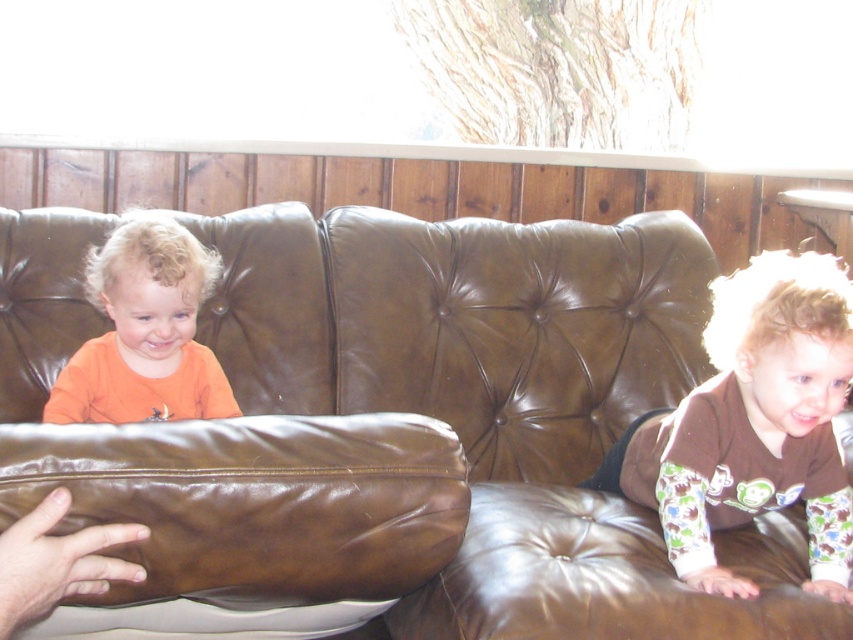
Question: Observing the image, what is the correct spatial positioning of brown cotton onesie at right in reference to brown leather hand at lower left?

Choices:
 (A) left
 (B) right

Answer: (B)

Question: Can you confirm if brown leather couch at center is thinner than orange matte shirt at left?

Choices:
 (A) yes
 (B) no

Answer: (B)

Question: Can you confirm if brown leather couch at center is positioned above brown cotton onesie at right?

Choices:
 (A) yes
 (B) no

Answer: (B)

Question: Among these objects, which one is farthest from the camera?

Choices:
 (A) brown cotton onesie at right
 (B) brown leather couch at center
 (C) brown leather hand at lower left
 (D) orange matte shirt at left

Answer: (D)

Question: Which is farther from the brown leather couch at center?

Choices:
 (A) brown leather hand at lower left
 (B) orange matte shirt at left

Answer: (A)

Question: Which of the following is the farthest from the observer?

Choices:
 (A) brown cotton onesie at right
 (B) brown leather hand at lower left
 (C) orange matte shirt at left
 (D) brown leather couch at center

Answer: (C)